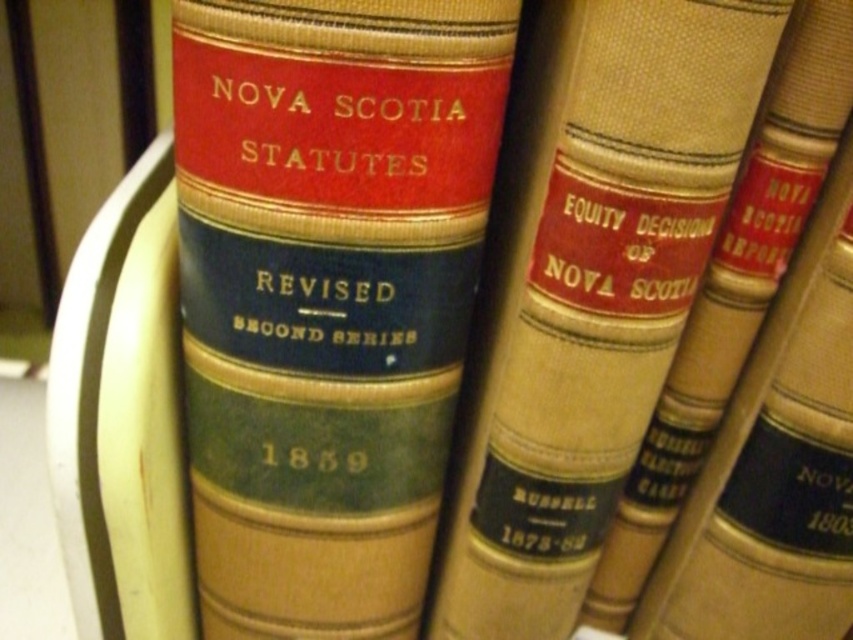
You are organizing books on a shelf and have two books in front of you. The matte leather book at center and the beige leather book at center. Which one is wider?

The matte leather book at center is wider than the beige leather book at center according to the description provided.

You are organizing a library and need to place a new book on the shelf. The new book has a red top band, a blue middle band, and a green bottom band on its spine. Where should you place it relative to the matte leather book at center?

The new book should be placed next to the matte leather book at center since it has the same color band pattern on its spine.

You are organizing a library shelf and need to place the matte leather book at center and the beige leather book at center in a specific order. According to their positions in the image, which book should be placed lower on the shelf?

The matte leather book at center should be placed lower on the shelf because it is located below the beige leather book at center in the image.